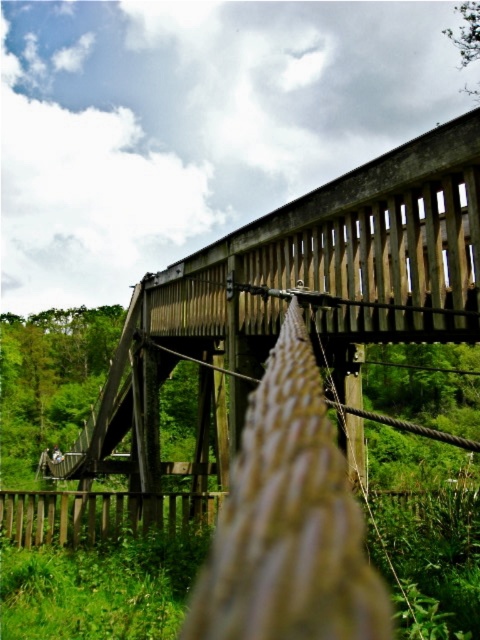
Is wooden bridge at center wider than brown wooden fence at lower center?

Yes, wooden bridge at center is wider than brown wooden fence at lower center.

This screenshot has width=480, height=640. Find the location of `wooden bridge at center`. wooden bridge at center is located at coordinates (283, 317).